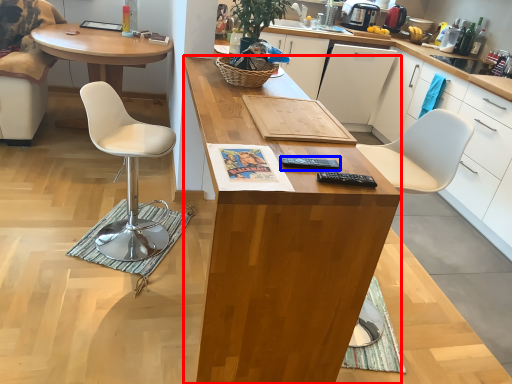
Question: Among these objects, which one is farthest to the camera, desk (highlighted by a red box) or remote control (highlighted by a blue box)?

Choices:
 (A) desk
 (B) remote control

Answer: (B)